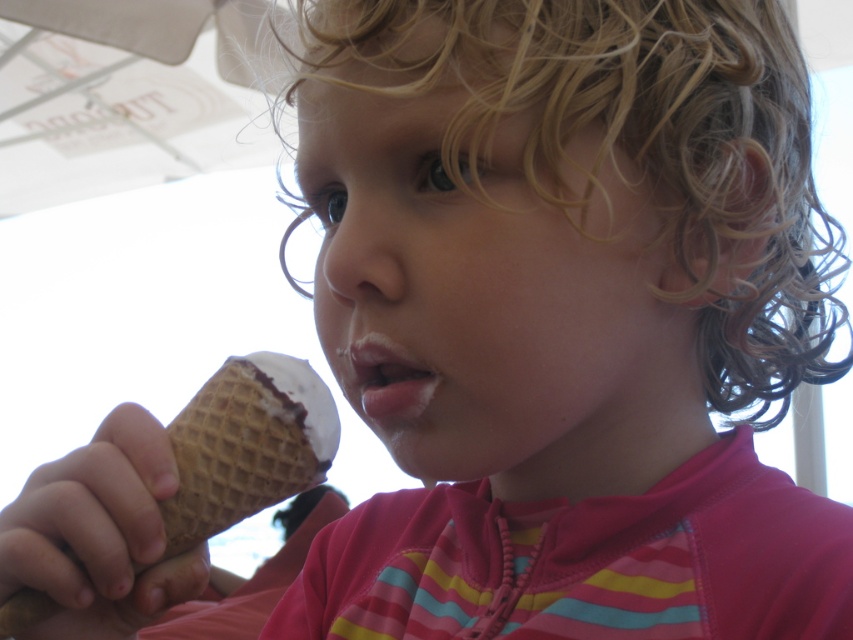
The child is holding the waffle cone ice cream at lower left and has pink matte lips at center. Which object is wider?

The waffle cone ice cream at lower left is wider than the pink matte lips at center.